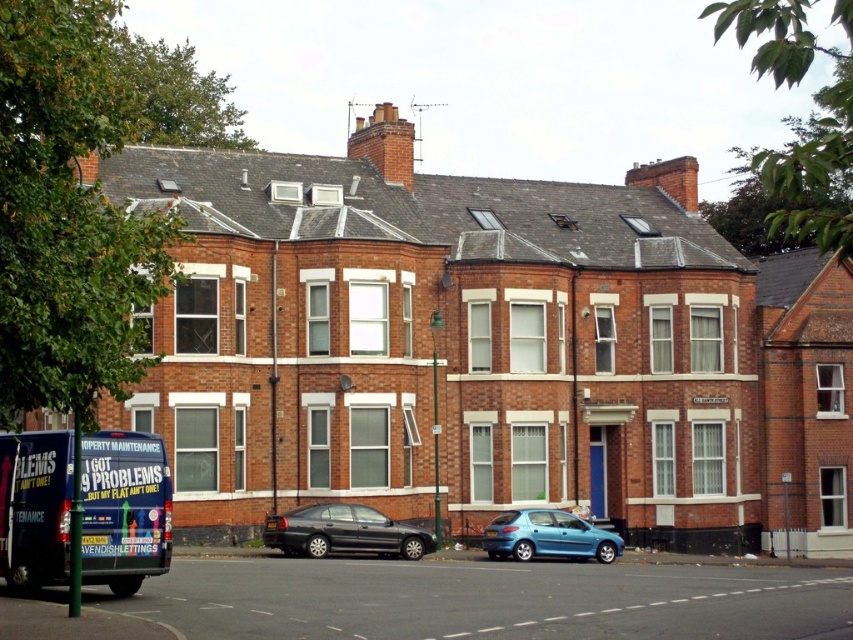
Question: Which object appears farthest from the camera in this image?

Choices:
 (A) metallic blue hatchback at center
 (B) shiny black sedan at lower center

Answer: (A)

Question: Is shiny black sedan at lower center further to camera compared to metallic blue hatchback at center?

Choices:
 (A) no
 (B) yes

Answer: (A)

Question: In this image, where is shiny black sedan at lower center located relative to metallic blue hatchback at center?

Choices:
 (A) right
 (B) left

Answer: (B)

Question: Which of the following is the closest to the observer?

Choices:
 (A) shiny black sedan at lower center
 (B) metallic blue hatchback at center

Answer: (A)

Question: Considering the relative positions of shiny black sedan at lower center and metallic blue hatchback at center in the image provided, where is shiny black sedan at lower center located with respect to metallic blue hatchback at center?

Choices:
 (A) right
 (B) left

Answer: (B)

Question: Which of the following is the farthest from the observer?

Choices:
 (A) (552, 547)
 (B) (418, 541)

Answer: (A)